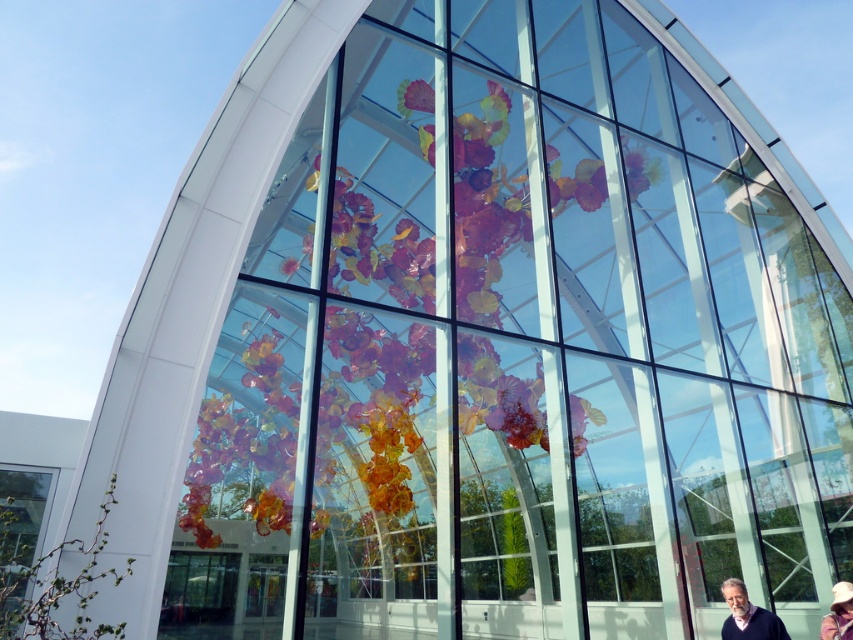
Question: Does translucent glass flower at center appear on the left side of matte black sweater at lower right?

Choices:
 (A) no
 (B) yes

Answer: (B)

Question: Considering the relative positions of matte black sweater at lower right and white textured hat at lower right in the image provided, where is matte black sweater at lower right located with respect to white textured hat at lower right?

Choices:
 (A) left
 (B) right

Answer: (A)

Question: Which object appears farthest from the camera in this image?

Choices:
 (A) matte black sweater at lower right
 (B) white textured hat at lower right
 (C) translucent glass flower at center

Answer: (C)

Question: Which point appears farthest from the camera in this image?

Choices:
 (A) (834, 636)
 (B) (407, 205)

Answer: (B)

Question: Considering the real-world distances, which object is closest to the white textured hat at lower right?

Choices:
 (A) translucent glass flower at center
 (B) matte black sweater at lower right

Answer: (B)

Question: Is translucent glass flower at center bigger than matte black sweater at lower right?

Choices:
 (A) yes
 (B) no

Answer: (A)